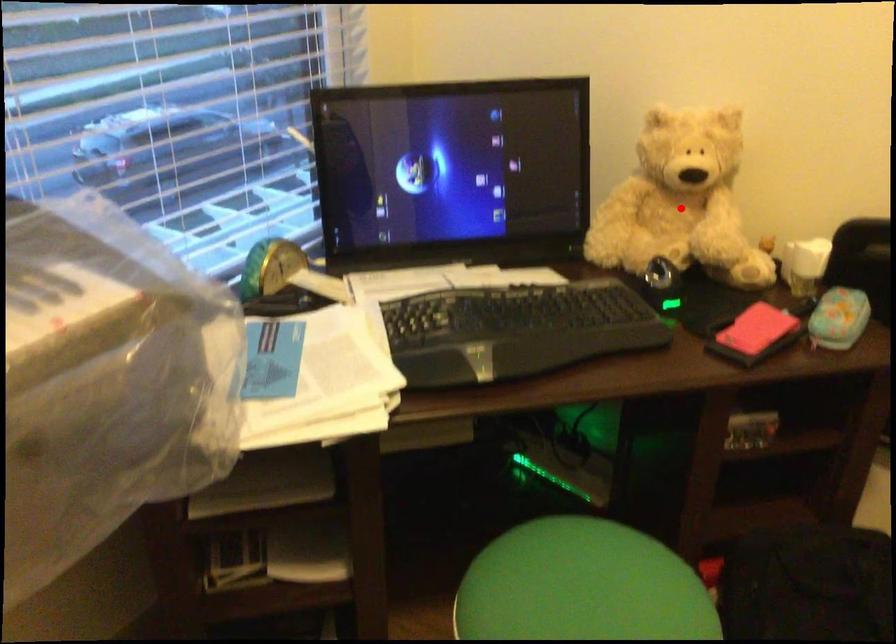
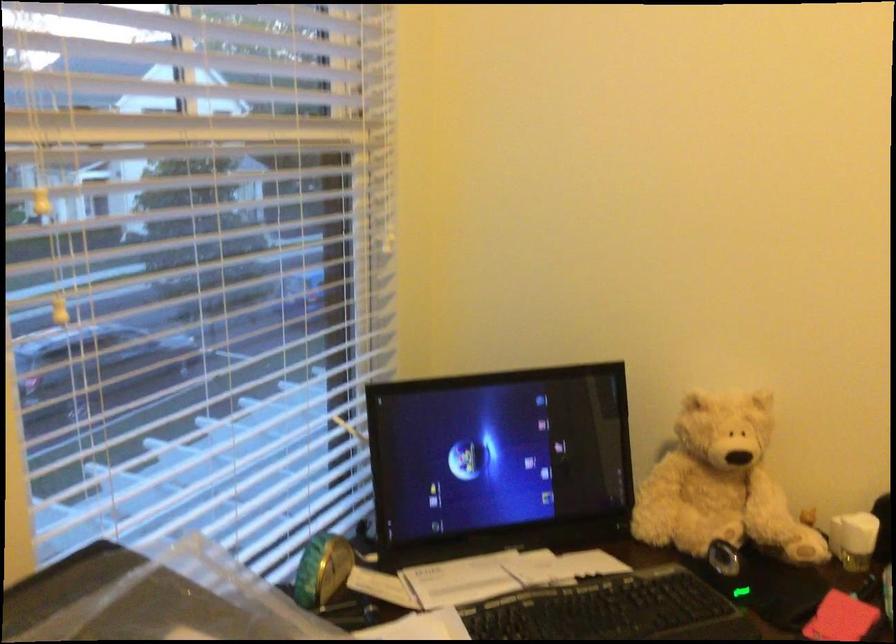
Where in the second image is the point corresponding to the highlighted location from the first image?

(720, 484)